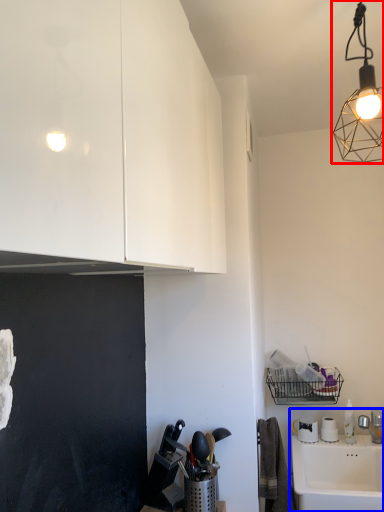
Question: Which object appears closest to the camera in this image, lamp (highlighted by a red box) or sink (highlighted by a blue box)?

Choices:
 (A) lamp
 (B) sink

Answer: (A)